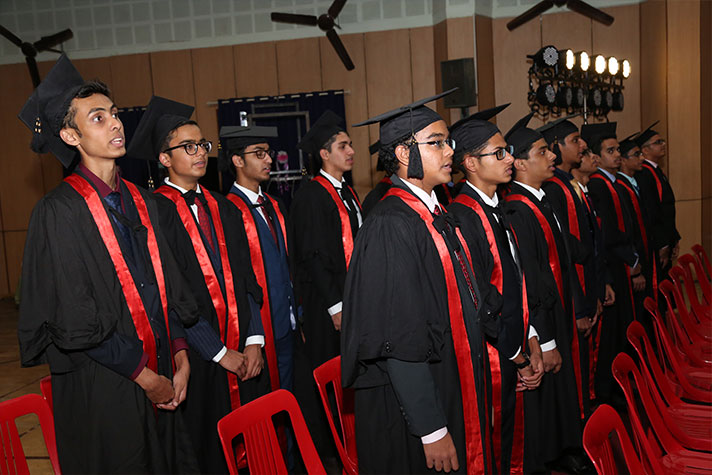
The width and height of the screenshot is (712, 475). I want to click on lights, so click(x=582, y=69).